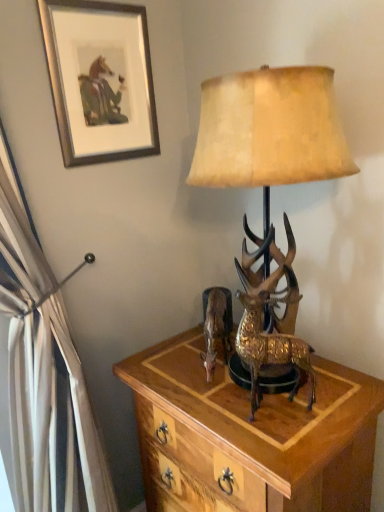
Question: Based on their positions, is gold textured deer at center located to the left or right of silver metallic picture frame at upper left?

Choices:
 (A) right
 (B) left

Answer: (A)

Question: Do you think gold textured deer at center is within silver metallic picture frame at upper left, or outside of it?

Choices:
 (A) outside
 (B) inside

Answer: (A)

Question: Estimate the real-world distances between objects in this image. Which object is closer to the wooden nightstand at center?

Choices:
 (A) gold textured deer at center
 (B) gold textured deer at center
 (C) metallic gold reindeer at center
 (D) silver metallic picture frame at upper left

Answer: (B)

Question: Which is nearer to the wooden nightstand at center?

Choices:
 (A) gold textured deer at center
 (B) gold textured deer at center
 (C) metallic gold reindeer at center
 (D) silver metallic picture frame at upper left

Answer: (A)